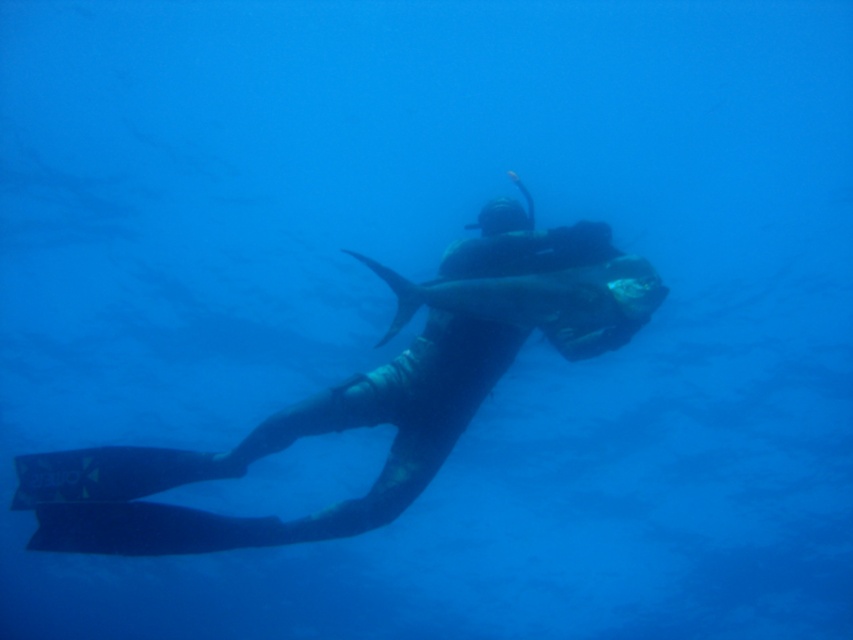
You are a marine biologist analyzing an underwater image. The coordinates point to a specific location in the scene. What object is located at coordinates point (276,451)?

The point (276,451) marks the black rubber wetsuit at center.

You are an underwater photographer aiming to capture the scuba diver and the large fish in a single frame. Given the black rubber wetsuit at center is positioned at coordinates 0.706, 0.324, where should you adjust your camera to ensure both the diver and the fish are fully visible?

To capture both the black rubber wetsuit at center and the large fish in the frame, position your camera so that the center of the frame aligns with the coordinates (276, 451) where the black rubber wetsuit at center is located. This ensures the diver and the fish are centered and fully visible within the camera view.

You are a scuba diver trying to take a photo of the fish. The camera is at your eye level, and you want to ensure the fish is in focus. Given that the camera has a depth of field that can sharply focus on objects within a 3.5 meter range from the lens, will the point at coordinates point (x=166, y=460) be within the camera focus range?

The point at coordinates point (x=166, y=460) is 4.00 meters away from the camera. Since the camera can only focus within 3.5 meters, the point is outside the focus range and will not be in sharp focus.